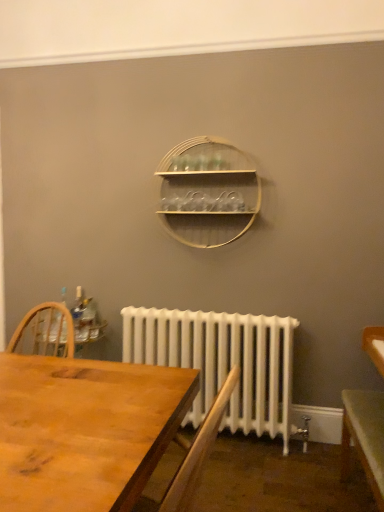
Question: Considering the relative positions of clear plastic bottle at left and green matte table at lower right in the image provided, is clear plastic bottle at left behind green matte table at lower right?

Choices:
 (A) no
 (B) yes

Answer: (B)

Question: From a real-world perspective, is clear plastic bottle at left positioned over green matte table at lower right based on gravity?

Choices:
 (A) yes
 (B) no

Answer: (A)

Question: Is clear plastic bottle at left far away from green matte table at lower right?

Choices:
 (A) no
 (B) yes

Answer: (B)

Question: Is clear plastic bottle at left shorter than green matte table at lower right?

Choices:
 (A) no
 (B) yes

Answer: (B)

Question: Can you see clear plastic bottle at left touching green matte table at lower right?

Choices:
 (A) yes
 (B) no

Answer: (B)

Question: Can you confirm if clear plastic bottle at left is wider than green matte table at lower right?

Choices:
 (A) no
 (B) yes

Answer: (A)

Question: From a real-world perspective, is clear plastic bottle at left beneath white painted radiator at lower center?

Choices:
 (A) no
 (B) yes

Answer: (A)

Question: Is clear plastic bottle at left oriented away from white painted radiator at lower center?

Choices:
 (A) no
 (B) yes

Answer: (A)

Question: Is clear plastic bottle at left further to the viewer compared to white painted radiator at lower center?

Choices:
 (A) yes
 (B) no

Answer: (A)

Question: From the image's perspective, would you say clear plastic bottle at left is positioned over white painted radiator at lower center?

Choices:
 (A) yes
 (B) no

Answer: (A)

Question: Is white painted radiator at lower center located within clear plastic bottle at left?

Choices:
 (A) yes
 (B) no

Answer: (B)

Question: Is clear plastic bottle at left in front of white painted radiator at lower center?

Choices:
 (A) yes
 (B) no

Answer: (B)

Question: From a real-world perspective, is wooden at center located higher than white painted radiator at lower center?

Choices:
 (A) yes
 (B) no

Answer: (A)